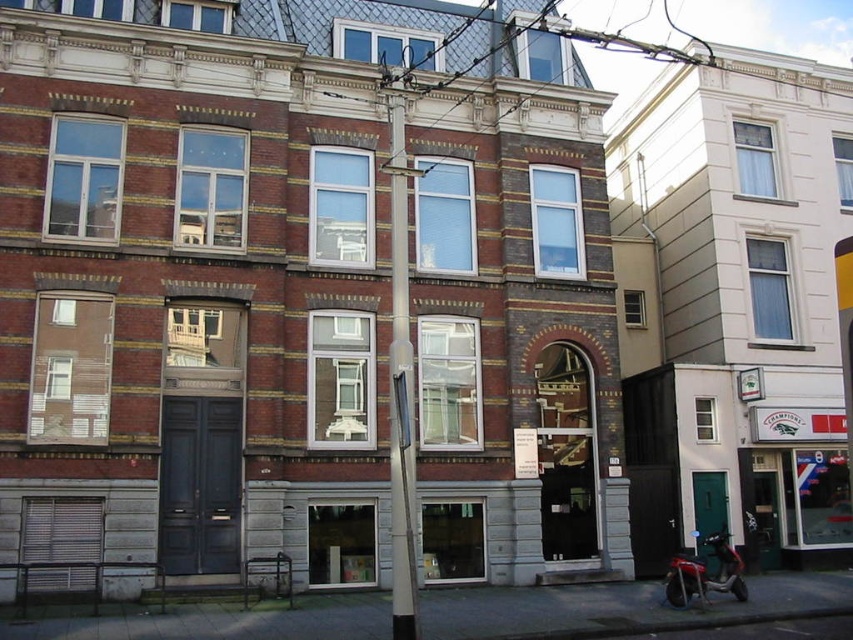
Question: Is silver metallic pole at center wider than metallic red scooter at lower right?

Choices:
 (A) no
 (B) yes

Answer: (A)

Question: Can you confirm if silver metallic pole at center is positioned above metallic red scooter at lower right?

Choices:
 (A) no
 (B) yes

Answer: (B)

Question: Can you confirm if silver metallic pole at center is positioned to the left of metallic red scooter at lower right?

Choices:
 (A) no
 (B) yes

Answer: (B)

Question: Which point is farther to the camera?

Choices:
 (A) (413, 628)
 (B) (732, 552)

Answer: (B)

Question: Which point is farther to the camera?

Choices:
 (A) silver metallic pole at center
 (B) metallic red scooter at lower right

Answer: (B)